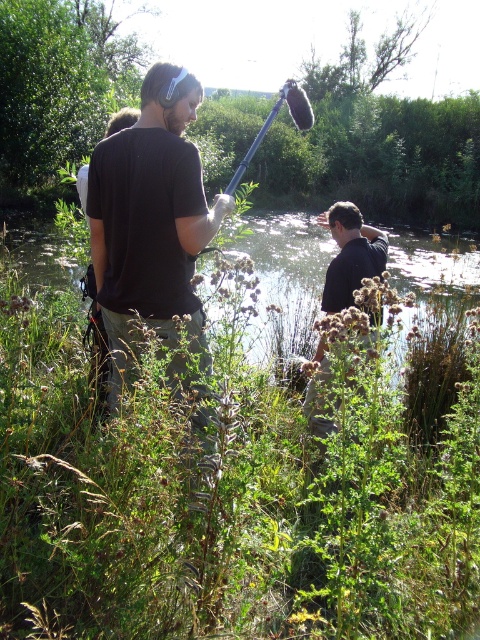
You are a photographer trying to capture both the black matte shirt at left and the black matte shirt at center in a single frame. Which person should you position closer to the camera to ensure both are fully visible?

To ensure both the black matte shirt at left and the black matte shirt at center are fully visible in the frame, you should position the black matte shirt at center closer to the camera. Since the black matte shirt at left is wider, placing the narrower black matte shirt at center closer will help balance their apparent sizes in the photo.